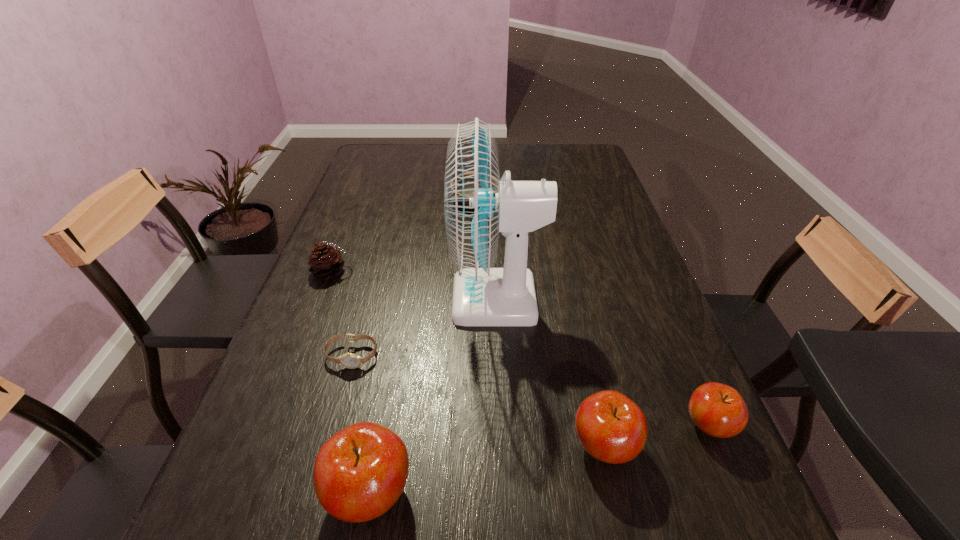
Identify the location of free space that satisfies the following two spatial constraints: 1. on the face of the second apple from right to left; 2. on the left side of the watch. The width and height of the screenshot is (960, 540). (327, 446).

Where is `vacant region that satisfies the following two spatial constraints: 1. in front of the tallest object to face the airflow; 2. on the face of the shortest object`? The width and height of the screenshot is (960, 540). vacant region that satisfies the following two spatial constraints: 1. in front of the tallest object to face the airflow; 2. on the face of the shortest object is located at coordinates (499, 355).

Locate an element on the screen. The height and width of the screenshot is (540, 960). vacant area that satisfies the following two spatial constraints: 1. with a leaf charm attached to the leftmost object; 2. on the back side of the second tallest apple is located at coordinates [x=265, y=446].

Find the location of a particular element. The height and width of the screenshot is (540, 960). vacant area that satisfies the following two spatial constraints: 1. with a leaf charm attached to the leftmost apple; 2. on the left side of the pinecone is located at coordinates (247, 492).

You are a GUI agent. You are given a task and a screenshot of the screen. Output one action in this format:
    pyautogui.click(x=<x>, y=<y>)
    Task: Click on the vacant area in the image that satisfies the following two spatial constraints: 1. on the face of the leftmost apple; 2. on the left side of the watch
    This screenshot has width=960, height=540.
    Given the screenshot: What is the action you would take?
    pyautogui.click(x=315, y=492)

Where is `vacant space that satisfies the following two spatial constraints: 1. on the back side of the second shortest apple; 2. in front of the fan to face the airflow`? vacant space that satisfies the following two spatial constraints: 1. on the back side of the second shortest apple; 2. in front of the fan to face the airflow is located at coordinates (571, 300).